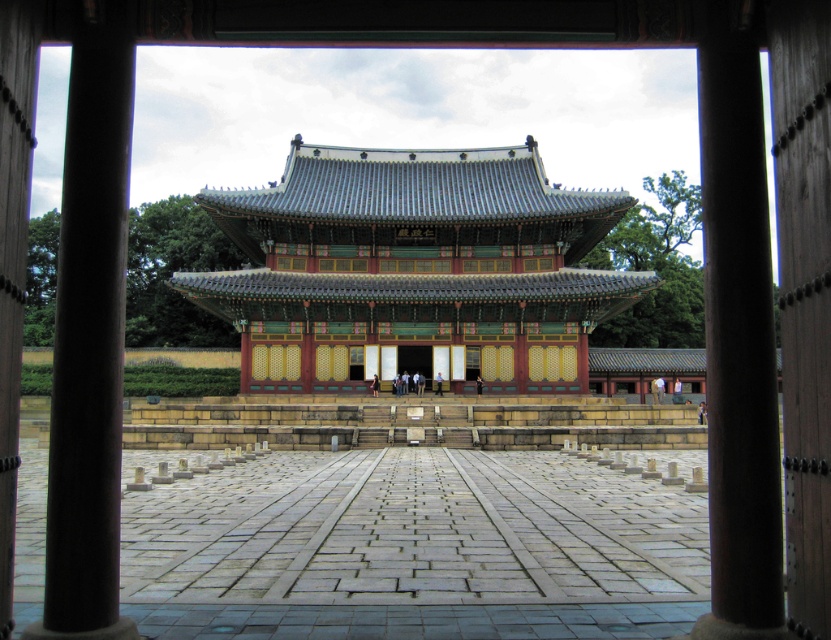
Which is below, polished wood palace at center or brown polished wood pillar at left?

brown polished wood pillar at left

What do you see at coordinates (412, 269) in the screenshot? I see `polished wood palace at center` at bounding box center [412, 269].

Does point (288, 184) come in front of point (62, 624)?

That is False.

This screenshot has width=831, height=640. I want to click on polished wood palace at center, so click(x=412, y=269).

Can you confirm if brown polished wood pillar at left is positioned to the right of brown wood pillar at right?

No, brown polished wood pillar at left is not to the right of brown wood pillar at right.

Is point (102, 611) less distant than point (756, 394)?

Yes, point (102, 611) is in front of point (756, 394).

Describe the element at coordinates (89, 349) in the screenshot. Image resolution: width=831 pixels, height=640 pixels. I see `brown polished wood pillar at left` at that location.

Where is `brown polished wood pillar at left`? The width and height of the screenshot is (831, 640). brown polished wood pillar at left is located at coordinates (89, 349).

Does polished wood palace at center have a lesser height compared to brown wood pillar at right?

No.

Is point (588, 236) more distant than point (760, 380)?

Yes, it is behind point (760, 380).

I want to click on polished wood palace at center, so click(x=412, y=269).